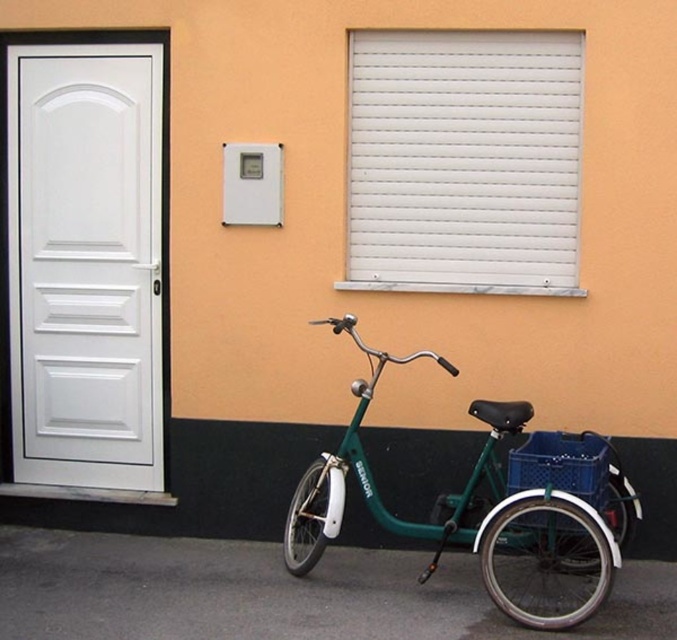
You are standing in front of the building and want to enter. The white matte door at left is locked, but there is a side entrance near the green matte tricycle at lower right. To reach the side entrance, should you walk to your left or right from the current position?

Since the white matte door at left is to the left of the green matte tricycle at lower right, the side entrance near the green matte tricycle at lower right would require you to walk to your right from the current position.

You are a delivery person trying to park your green matte tricycle at lower right near the white matte door at left. Can you park the tricycle in front of the door without blocking it?

The green matte tricycle at lower right is currently behind the white matte door at left, so it is not blocking the door. However, to park it in front of the door without blocking, ensure it is placed in front where it does not obstruct the door access.